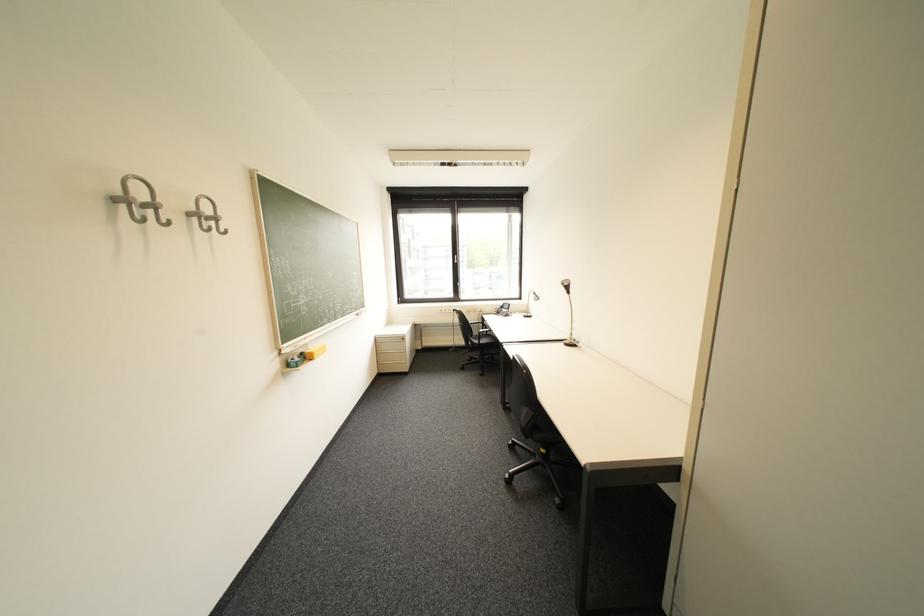
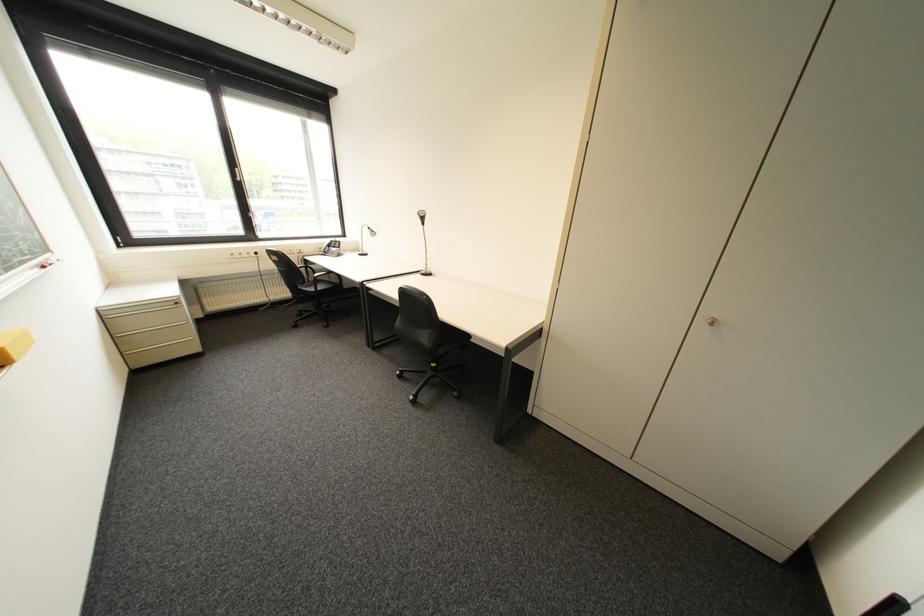
Where in the second image is the point corresponding to point 388,342 from the first image?

(119, 318)